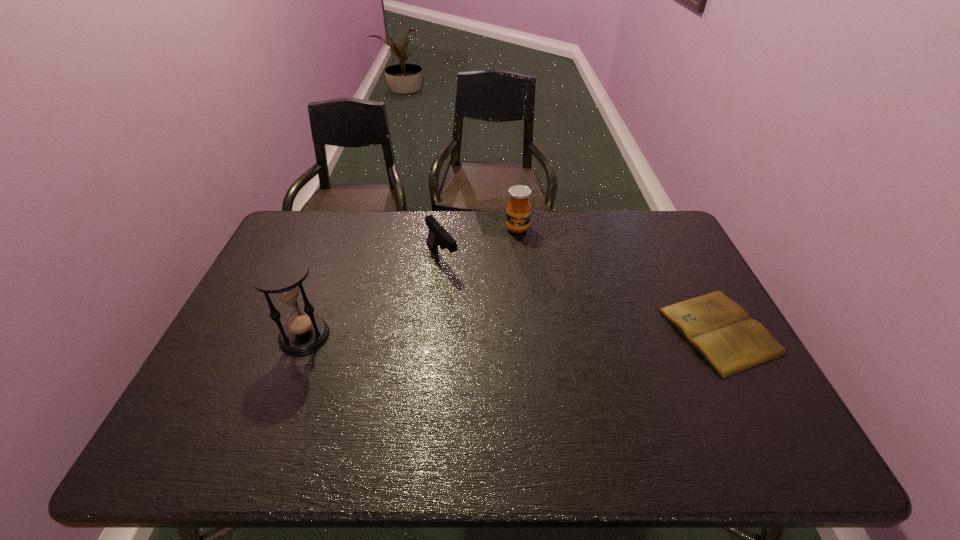
Find the location of a particular element. This screenshot has height=540, width=960. vacant space located 0.300m on the front-facing side of the second shortest object is located at coordinates (503, 335).

You are a GUI agent. You are given a task and a screenshot of the screen. Output one action in this format:
    pyautogui.click(x=<x>, y=<y>)
    Task: Click on the vacant position located 0.100m on the front-facing side of the second shortest object
    Image resolution: width=960 pixels, height=540 pixels.
    Given the screenshot: What is the action you would take?
    pyautogui.click(x=466, y=292)

Find the location of a particular element. This screenshot has height=540, width=960. free space located on the front-facing side of the second shortest object is located at coordinates (524, 361).

Locate an element on the screen. vacant space situated 0.110m on the front-facing side of the honey is located at coordinates (521, 256).

Locate an element on the screen. This screenshot has height=540, width=960. vacant space situated 0.370m on the front-facing side of the honey is located at coordinates (529, 314).

The width and height of the screenshot is (960, 540). I want to click on blank area located 0.340m on the front-facing side of the honey, so click(528, 307).

The width and height of the screenshot is (960, 540). Identify the location of pistol located at the far edge. (438, 236).

The height and width of the screenshot is (540, 960). In order to click on honey that is at the far edge in this screenshot , I will do `click(518, 214)`.

This screenshot has height=540, width=960. I want to click on object present at the left edge, so click(282, 275).

At what (x,y) coordinates should I click in order to perform the action: click on object that is at the right edge. Please return your answer as a coordinate pair (x, y). The image size is (960, 540). Looking at the image, I should click on (718, 328).